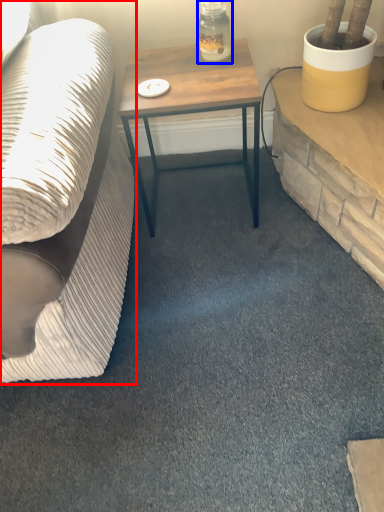
Question: Which object is further to the camera taking this photo, studio couch (highlighted by a red box) or bottle (highlighted by a blue box)?

Choices:
 (A) studio couch
 (B) bottle

Answer: (B)